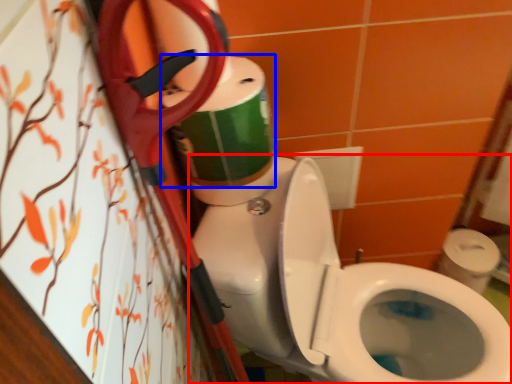
Question: Which point is further to the camera, toilet (highlighted by a red box) or toilet paper (highlighted by a blue box)?

Choices:
 (A) toilet
 (B) toilet paper

Answer: (B)